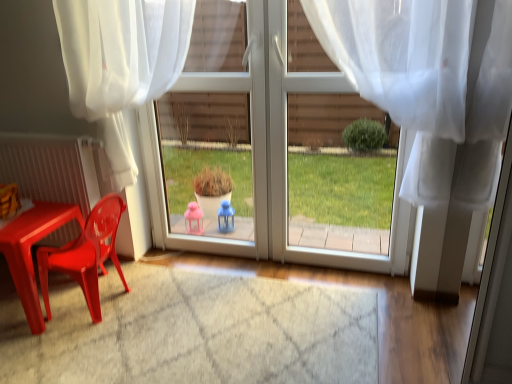
In order to face matte plastic radiator at left, should I rotate leftwards or rightwards?

You should look left and rotate roughly 26.986 degrees.

In order to click on matte plastic chair at left in this screenshot , I will do `click(86, 254)`.

How much space does translucent white curtain at center, positioned as the 1th curtain in right-to-left order, occupy vertically?

It is 33.21 inches.

Where is `white glossy door at center`? white glossy door at center is located at coordinates (270, 155).

Between translucent white curtain at center, marked as the 2th curtain in a left-to-right arrangement, and white glossy door at center, which one appears on the right side from the viewer's perspective?

translucent white curtain at center, marked as the 2th curtain in a left-to-right arrangement, is more to the right.

Would you say translucent white curtain at center, marked as the 2th curtain in a left-to-right arrangement, is inside or outside white glossy door at center?

translucent white curtain at center, marked as the 2th curtain in a left-to-right arrangement, is not enclosed by white glossy door at center.

Does translucent white curtain at center, positioned as the 1th curtain in right-to-left order, have a smaller size compared to white glossy door at center?

Incorrect, translucent white curtain at center, positioned as the 1th curtain in right-to-left order, is not smaller in size than white glossy door at center.

From a real-world perspective, is translucent white curtain at center, marked as the 2th curtain in a left-to-right arrangement, over white glossy door at center?

Yes.

Is white sheer curtain at upper left, which ranks as the 2th curtain in right-to-left order, located outside matte plastic chair at left?

Yes.

Is white sheer curtain at upper left, which ranks as the 2th curtain in right-to-left order, shorter than matte plastic chair at left?

No.

Between white sheer curtain at upper left, which is counted as the 1th curtain, starting from the left, and matte plastic chair at left, which one appears on the left side from the viewer's perspective?

From the viewer's perspective, matte plastic chair at left appears more on the left side.

Is white sheer curtain at upper left, which is counted as the 1th curtain, starting from the left, looking in the opposite direction of matte plastic chair at left?

No, white sheer curtain at upper left, which is counted as the 1th curtain, starting from the left, is not facing the opposite direction of matte plastic chair at left.

Considering the sizes of objects white glossy door at center and matte plastic radiator at left in the image provided, who is bigger, white glossy door at center or matte plastic radiator at left?

white glossy door at center is bigger.

Considering the positions of objects white glossy door at center and matte plastic radiator at left in the image provided, who is in front, white glossy door at center or matte plastic radiator at left?

white glossy door at center is more forward.

How many degrees apart are the facing directions of white glossy door at center and matte plastic radiator at left?

0.555 degrees separate the facing orientations of white glossy door at center and matte plastic radiator at left.

Is white glossy door at center oriented away from matte plastic radiator at left?

No.

Is translucent white curtain at center, marked as the 2th curtain in a left-to-right arrangement, bigger than white sheer curtain at upper left, which is counted as the 1th curtain, starting from the left?

No, translucent white curtain at center, marked as the 2th curtain in a left-to-right arrangement, is not bigger than white sheer curtain at upper left, which is counted as the 1th curtain, starting from the left.

Can you see translucent white curtain at center, positioned as the 1th curtain in right-to-left order, touching white sheer curtain at upper left, which is counted as the 1th curtain, starting from the left?

translucent white curtain at center, positioned as the 1th curtain in right-to-left order, is not next to white sheer curtain at upper left, which is counted as the 1th curtain, starting from the left, and they're not touching.

How different are the orientations of translucent white curtain at center, marked as the 2th curtain in a left-to-right arrangement, and white sheer curtain at upper left, which is counted as the 1th curtain, starting from the left, in degrees?

The angle between the facing direction of translucent white curtain at center, marked as the 2th curtain in a left-to-right arrangement, and the facing direction of white sheer curtain at upper left, which is counted as the 1th curtain, starting from the left, is 0.00168 degrees.

From the image's perspective, is translucent white curtain at center, positioned as the 1th curtain in right-to-left order, under white sheer curtain at upper left, which is counted as the 1th curtain, starting from the left?

Yes.

From the image's perspective, is white glossy door at center under white sheer curtain at upper left, which is counted as the 1th curtain, starting from the left?

Indeed, from the image's perspective, white glossy door at center is shown beneath white sheer curtain at upper left, which is counted as the 1th curtain, starting from the left.

Looking at this image, from a real-world perspective, who is located higher, white glossy door at center or white sheer curtain at upper left, which is counted as the 1th curtain, starting from the left?

white sheer curtain at upper left, which is counted as the 1th curtain, starting from the left, is physically above.

Is white glossy door at center oriented towards white sheer curtain at upper left, which is counted as the 1th curtain, starting from the left?

Yes.

Where is `curtain that is the 2nd object located above the white glossy door at center (from the image's perspective)`? The width and height of the screenshot is (512, 384). curtain that is the 2nd object located above the white glossy door at center (from the image's perspective) is located at coordinates (121, 62).

Which is behind, point (388, 22) or point (42, 266)?

Positioned behind is point (42, 266).

How different are the orientations of translucent white curtain at center, positioned as the 1th curtain in right-to-left order, and matte plastic chair at left in degrees?

The angle between the facing direction of translucent white curtain at center, positioned as the 1th curtain in right-to-left order, and the facing direction of matte plastic chair at left is 89.2 degrees.

Considering the sizes of translucent white curtain at center, positioned as the 1th curtain in right-to-left order, and matte plastic chair at left in the image, is translucent white curtain at center, positioned as the 1th curtain in right-to-left order, wider or thinner than matte plastic chair at left?

In the image, translucent white curtain at center, positioned as the 1th curtain in right-to-left order, appears to be more narrow than matte plastic chair at left.

From the picture: Is translucent white curtain at center, marked as the 2th curtain in a left-to-right arrangement, not within matte plastic chair at left?

Yes.

From the image's perspective, would you say matte plastic radiator at left is shown under translucent white curtain at center, positioned as the 1th curtain in right-to-left order?

Indeed, from the image's perspective, matte plastic radiator at left is shown beneath translucent white curtain at center, positioned as the 1th curtain in right-to-left order.

Is matte plastic radiator at left taller than translucent white curtain at center, positioned as the 1th curtain in right-to-left order?

No.

Is matte plastic radiator at left turned away from translucent white curtain at center, marked as the 2th curtain in a left-to-right arrangement?

matte plastic radiator at left does not have its back to translucent white curtain at center, marked as the 2th curtain in a left-to-right arrangement.

The image size is (512, 384). In order to click on curtain that is the 1st one above the white glossy door at center (from a real-world perspective) in this screenshot , I will do `click(428, 86)`.

From the matte plastic chair at left, count 1st curtain to the right and point to it. Please provide its 2D coordinates.

[(121, 62)]

Considering their positions, is matte plastic chair at left positioned further to translucent white curtain at center, positioned as the 1th curtain in right-to-left order, than white glossy door at center?

Among the two, matte plastic chair at left is located further to translucent white curtain at center, positioned as the 1th curtain in right-to-left order.

Considering their positions, is matte plastic table at lower left positioned further to matte plastic radiator at left than matte plastic chair at left?

matte plastic chair at left lies further to matte plastic radiator at left than the other object.

Considering their positions, is white glossy door at center positioned closer to translucent white curtain at center, marked as the 2th curtain in a left-to-right arrangement, than white sheer curtain at upper left, which ranks as the 2th curtain in right-to-left order?

The object closer to translucent white curtain at center, marked as the 2th curtain in a left-to-right arrangement, is white glossy door at center.

Which object lies nearer to the anchor point matte plastic chair at left, white glossy door at center or white sheer curtain at upper left, which is counted as the 1th curtain, starting from the left?

Based on the image, white sheer curtain at upper left, which is counted as the 1th curtain, starting from the left, appears to be nearer to matte plastic chair at left.

From the image, which object appears to be nearer to translucent white curtain at center, positioned as the 1th curtain in right-to-left order, matte plastic table at lower left or white sheer curtain at upper left, which ranks as the 2th curtain in right-to-left order?

white sheer curtain at upper left, which ranks as the 2th curtain in right-to-left order.

Which object lies further to the anchor point translucent white curtain at center, marked as the 2th curtain in a left-to-right arrangement, matte plastic radiator at left or white glossy door at center?

matte plastic radiator at left is further to translucent white curtain at center, marked as the 2th curtain in a left-to-right arrangement.

When comparing their distances from matte plastic radiator at left, does matte plastic table at lower left or translucent white curtain at center, positioned as the 1th curtain in right-to-left order, seem closer?

Among the two, matte plastic table at lower left is located nearer to matte plastic radiator at left.

Which object lies nearer to the anchor point matte plastic table at lower left, white sheer curtain at upper left, which is counted as the 1th curtain, starting from the left, or matte plastic chair at left?

matte plastic chair at left.

The height and width of the screenshot is (384, 512). Identify the location of curtain between matte plastic table at lower left and white glossy door at center from left to right. (121, 62).

Find the location of a particular element. The image size is (512, 384). curtain between matte plastic table at lower left and translucent white curtain at center, positioned as the 1th curtain in right-to-left order, from left to right is located at coordinates (121, 62).

You are a GUI agent. You are given a task and a screenshot of the screen. Output one action in this format:
    pyautogui.click(x=<x>, y=<y>)
    Task: Click on the curtain between matte plastic radiator at left and translucent white curtain at center, marked as the 2th curtain in a left-to-right arrangement
    
    Given the screenshot: What is the action you would take?
    pyautogui.click(x=121, y=62)

In order to click on radiator situated between matte plastic table at lower left and translucent white curtain at center, positioned as the 1th curtain in right-to-left order, from left to right in this screenshot , I will do click(x=51, y=168).